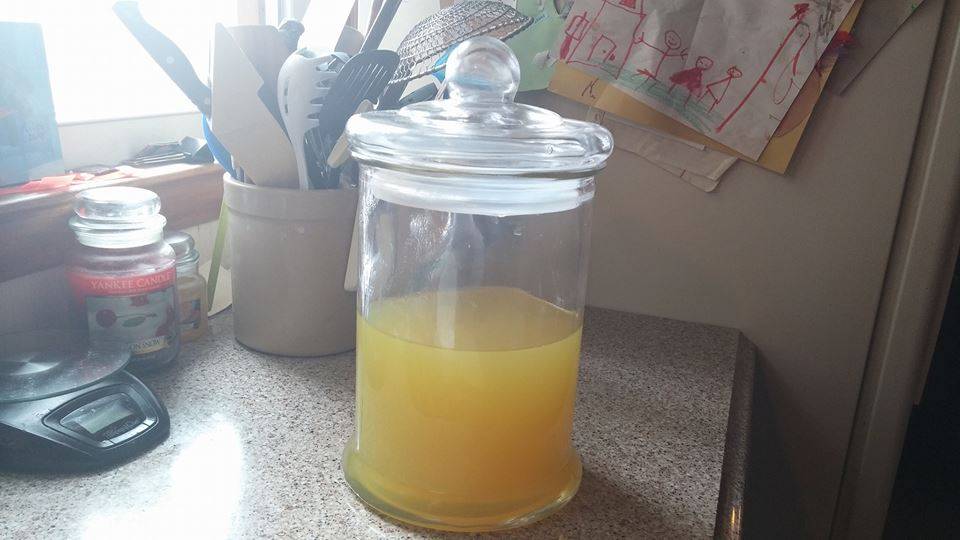
The width and height of the screenshot is (960, 540). Find the location of `1 counter`. 1 counter is located at coordinates (286, 494).